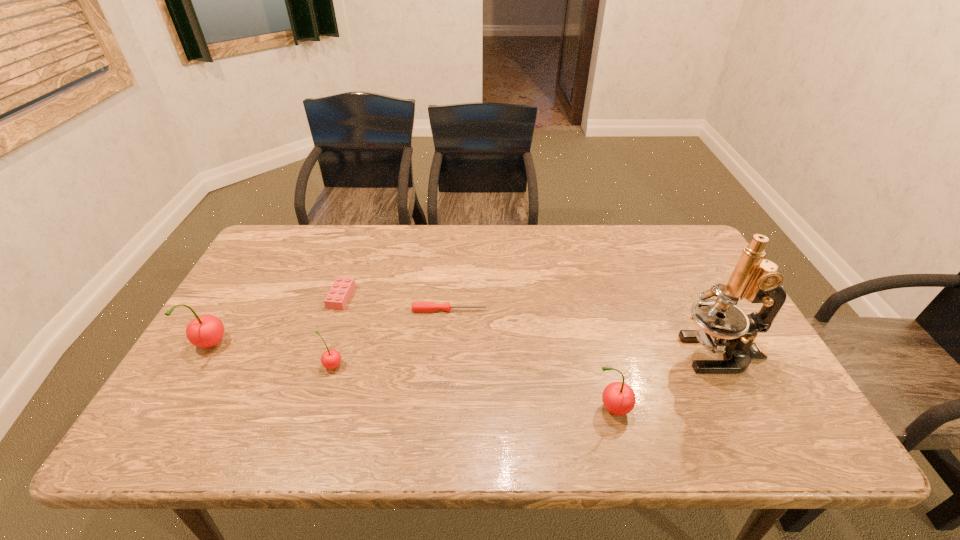
Select which cherry appears as the closest to the fifth object from left to right. Please provide its 2D coordinates. Your answer should be formatted as a tuple, i.e. [(x, y)], where the tuple contains the x and y coordinates of a point satisfying the conditions above.

[(330, 359)]

Where is `vacant space that satisfies the following two spatial constraints: 1. at the tip of the fourth object from left to right; 2. on the front side of the third shortest object`? vacant space that satisfies the following two spatial constraints: 1. at the tip of the fourth object from left to right; 2. on the front side of the third shortest object is located at coordinates (445, 366).

This screenshot has width=960, height=540. In order to click on vacant area that satisfies the following two spatial constraints: 1. at the tip of the shortest object; 2. on the right side of the rightmost cherry in this screenshot , I will do `click(443, 409)`.